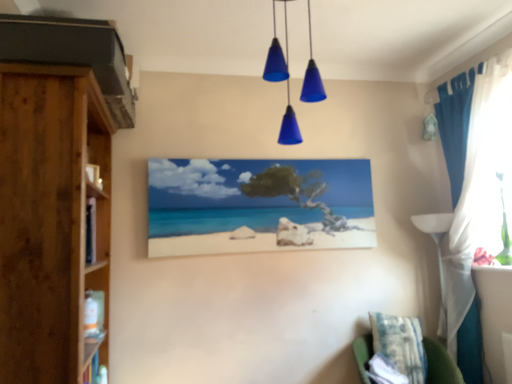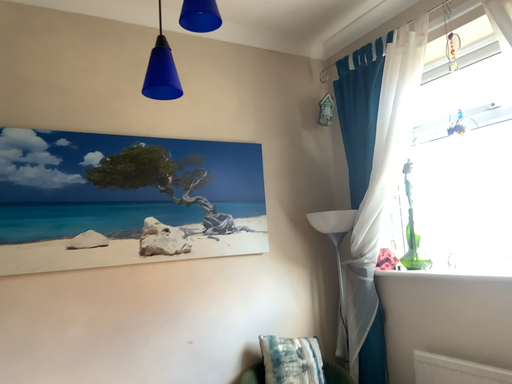
Question: Which way did the camera rotate in the video?

Choices:
 (A) rotated right
 (B) rotated left

Answer: (A)